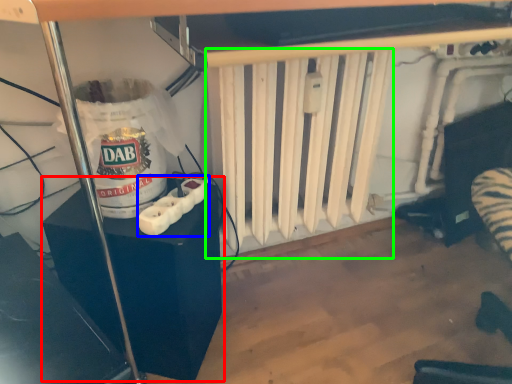
Question: Which is nearer to the furniture (highlighted by a red box)? Wii controller (highlighted by a blue box) or radiator (highlighted by a green box).

Choices:
 (A) Wii controller
 (B) radiator

Answer: (A)